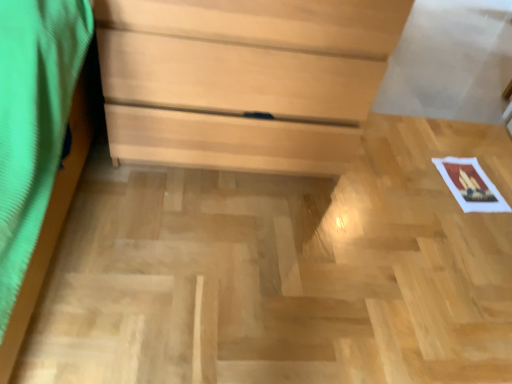
Image resolution: width=512 pixels, height=384 pixels. What do you see at coordinates (249, 54) in the screenshot?
I see `light brown wood chest of drawers at center` at bounding box center [249, 54].

This screenshot has width=512, height=384. In order to click on light brown wood chest of drawers at center in this screenshot , I will do `click(249, 54)`.

You are a GUI agent. You are given a task and a screenshot of the screen. Output one action in this format:
    pyautogui.click(x=<x>, y=<y>)
    Task: Click on the light brown wood chest of drawers at center
    Image resolution: width=512 pixels, height=384 pixels.
    Given the screenshot: What is the action you would take?
    pyautogui.click(x=249, y=54)